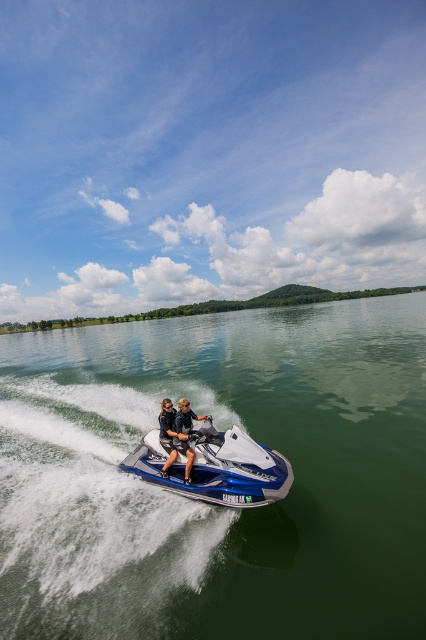
Question: Does blue metallic water at center have a lesser width compared to black matte life vest at center?

Choices:
 (A) yes
 (B) no

Answer: (B)

Question: Which object appears farthest from the camera in this image?

Choices:
 (A) black matte wetsuits at center
 (B) blue metallic water at center
 (C) black matte life vest at center

Answer: (C)

Question: Which point is closer to the camera taking this photo?

Choices:
 (A) (161, 468)
 (B) (345, 582)

Answer: (B)

Question: Can you confirm if blue metallic jet ski at center is positioned below black matte wetsuits at center?

Choices:
 (A) yes
 (B) no

Answer: (A)

Question: Does black matte wetsuits at center have a smaller size compared to black matte life vest at center?

Choices:
 (A) yes
 (B) no

Answer: (B)

Question: Estimate the real-world distances between objects in this image. Which object is closer to the blue metallic jet ski at center?

Choices:
 (A) black matte life vest at center
 (B) blue metallic water at center
 (C) black matte wetsuits at center

Answer: (C)